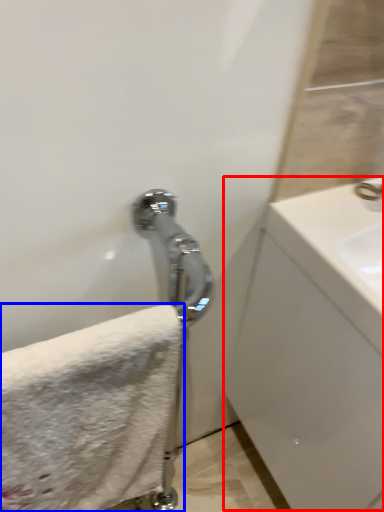
Question: Which object appears closest to the camera in this image, counter top (highlighted by a red box) or towel (highlighted by a blue box)?

Choices:
 (A) counter top
 (B) towel

Answer: (B)